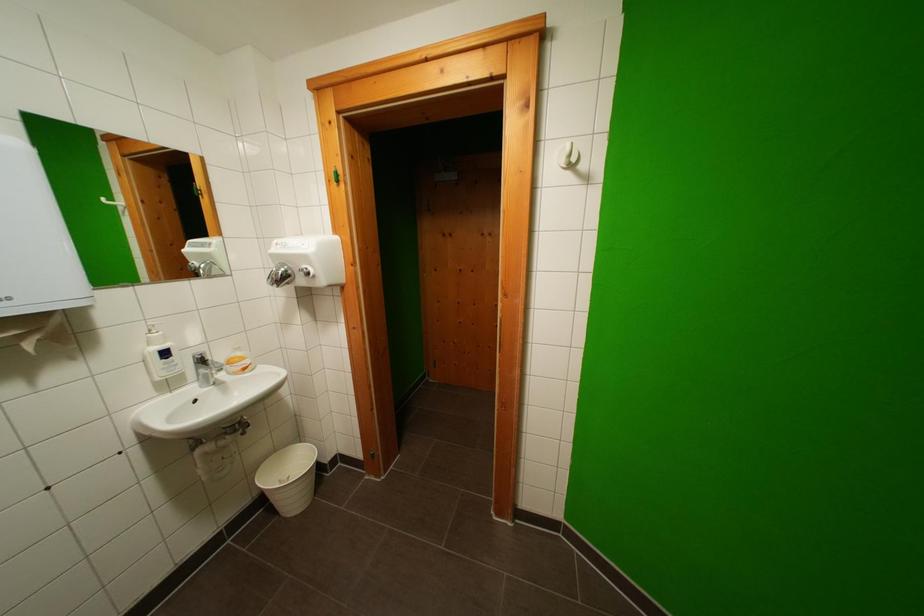
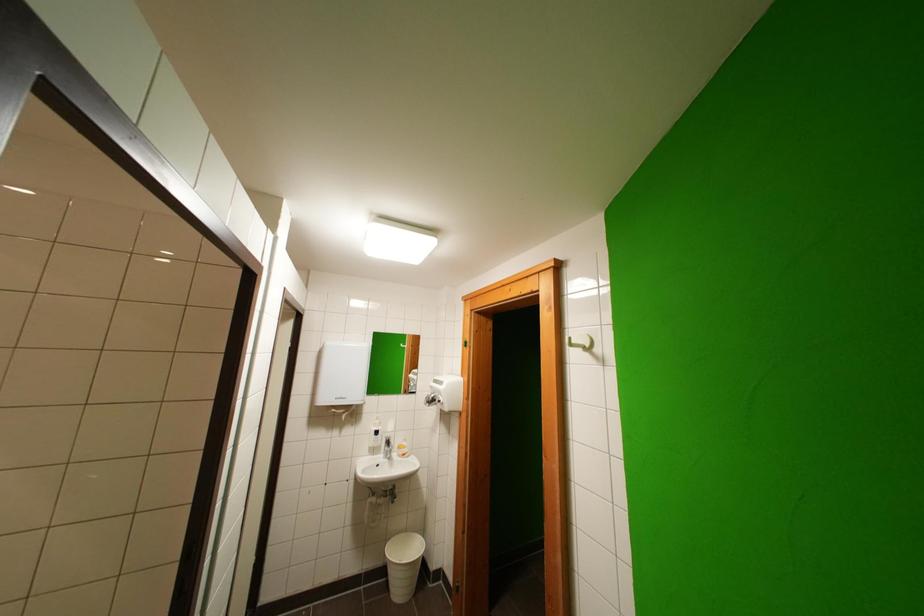
Where in the second image is the point corresponding to the point at 301,507 from the first image?

(406, 593)